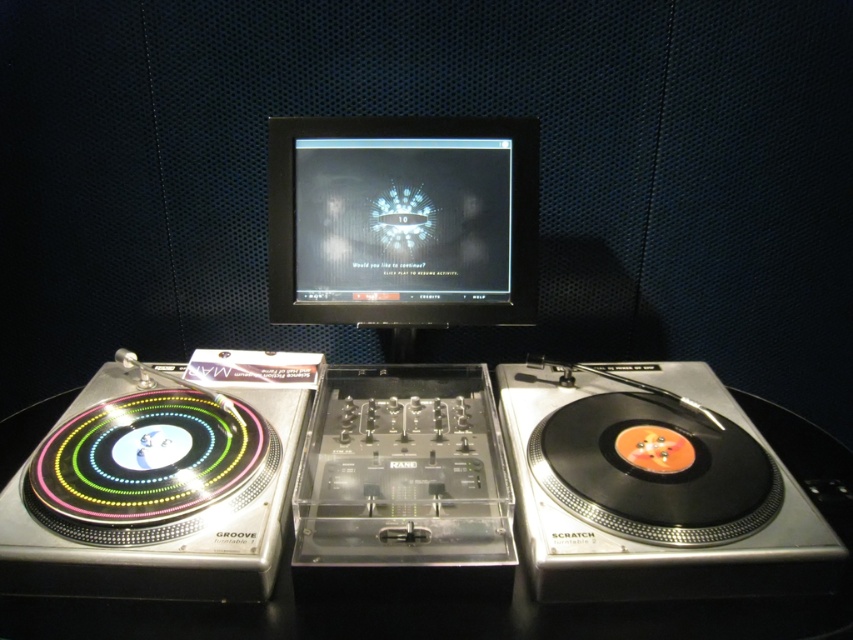
Can you confirm if black vinyl record at right is positioned below black glossy monitor at center?

Indeed, black vinyl record at right is positioned under black glossy monitor at center.

Consider the image. Can you confirm if black vinyl record at right is shorter than black glossy monitor at center?

Yes.

Find the location of a particular element. black vinyl record at right is located at coordinates (653, 493).